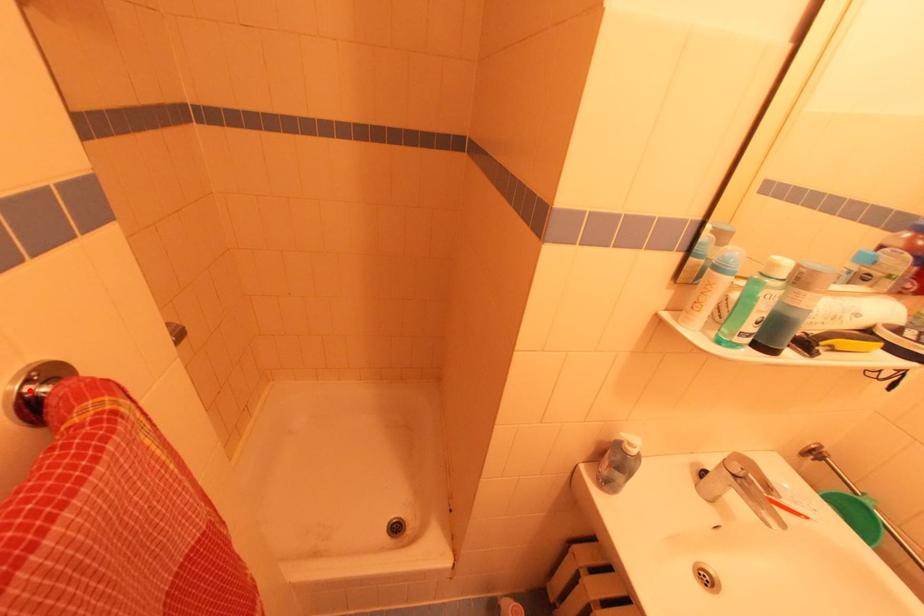
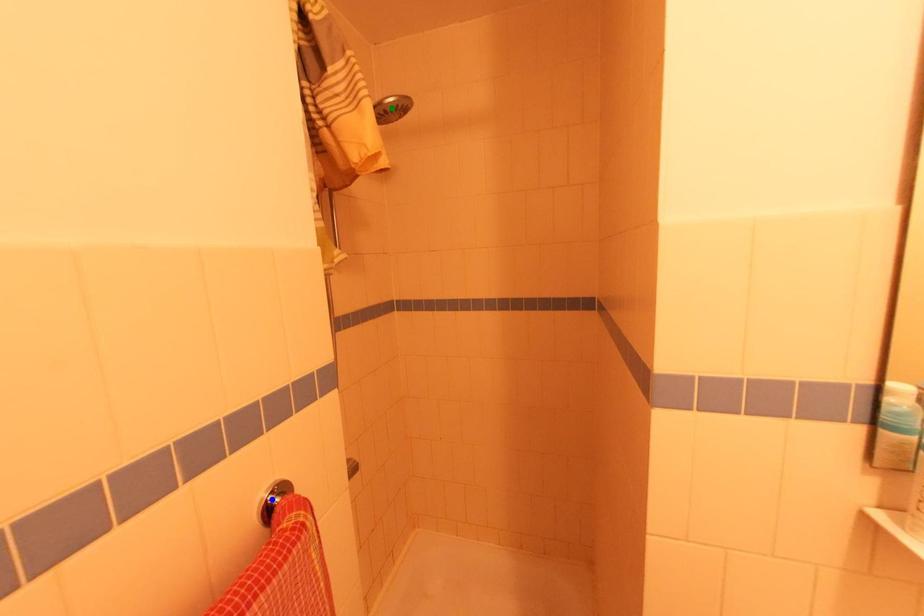
Question: I am providing you with two images of the same scene from different viewpoints. A red point is marked on the first image. You are given multiple points on the second image. Which point in image 2 represents the same 3d spot as the red point in image 1?

Choices:
 (A) yellow point
 (B) green point
 (C) blue point

Answer: (C)